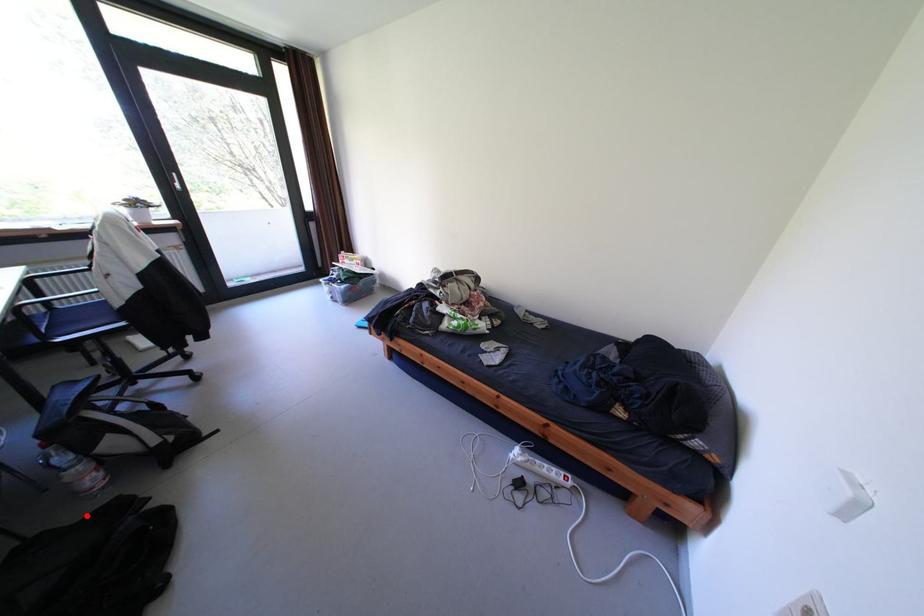
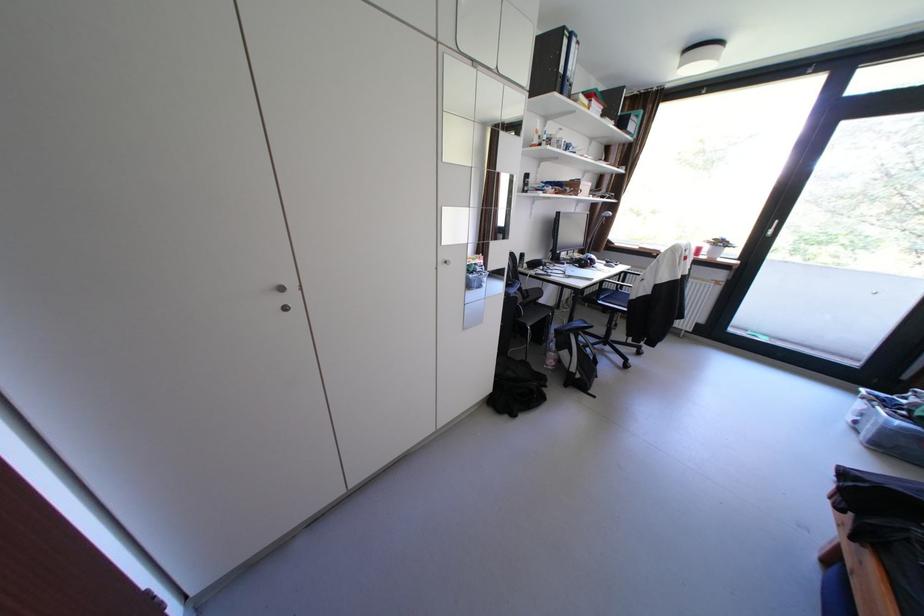
In the second image, find the point that corresponds to the highlighted location in the first image.

(546, 368)